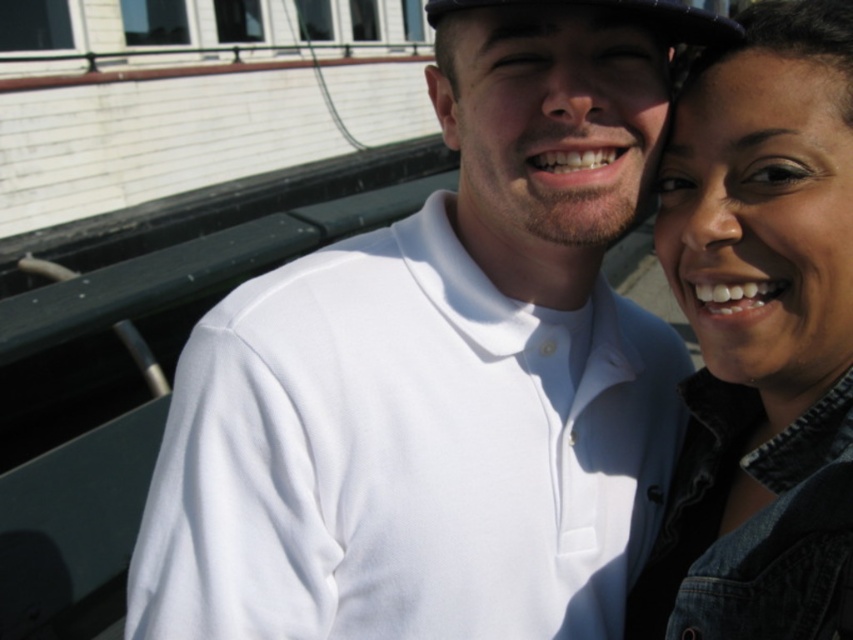
Question: Considering the real-world distances, which object is closest to the white matte shirt at center?

Choices:
 (A) black fabric baseball hat at upper center
 (B) denim jacket at upper right

Answer: (B)

Question: Which point appears closest to the camera in this image?

Choices:
 (A) (660, 17)
 (B) (519, 113)
 (C) (729, 164)

Answer: (B)

Question: Can you confirm if white matte shirt at center is thinner than denim jacket at upper right?

Choices:
 (A) yes
 (B) no

Answer: (B)

Question: Can you confirm if white matte shirt at center is wider than black fabric baseball hat at upper center?

Choices:
 (A) no
 (B) yes

Answer: (B)

Question: Does white matte shirt at center appear under denim jacket at upper right?

Choices:
 (A) no
 (B) yes

Answer: (B)

Question: Estimate the real-world distances between objects in this image. Which object is closer to the white matte shirt at center?

Choices:
 (A) denim jacket at upper right
 (B) black fabric baseball hat at upper center

Answer: (A)